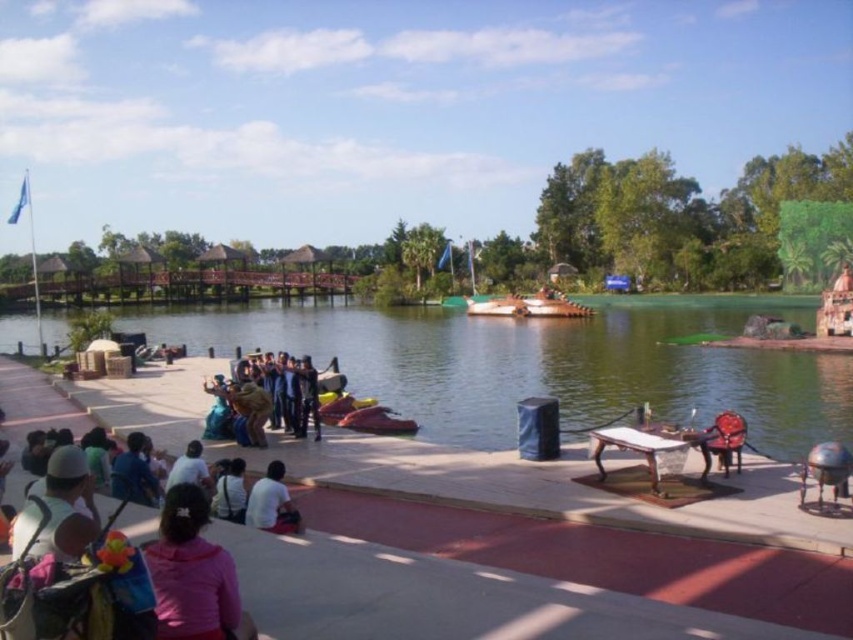
You are at the park and want to take a photo of the wooden bridge at upper center. Where should you position yourself to capture it in the frame?

Position yourself at point (665, 220) to capture the wooden bridge at upper center in the frame.

You are a photographer standing in the park and want to capture a photo of the wooden bridge at upper center without the pink fabric at lower left appearing in the frame. Is this possible?

The pink fabric at lower left is behind the wooden bridge at upper center, so if you position yourself so the bridge is between the fabric and your camera, the fabric will be obscured. Yes, it is possible to take such a photo.